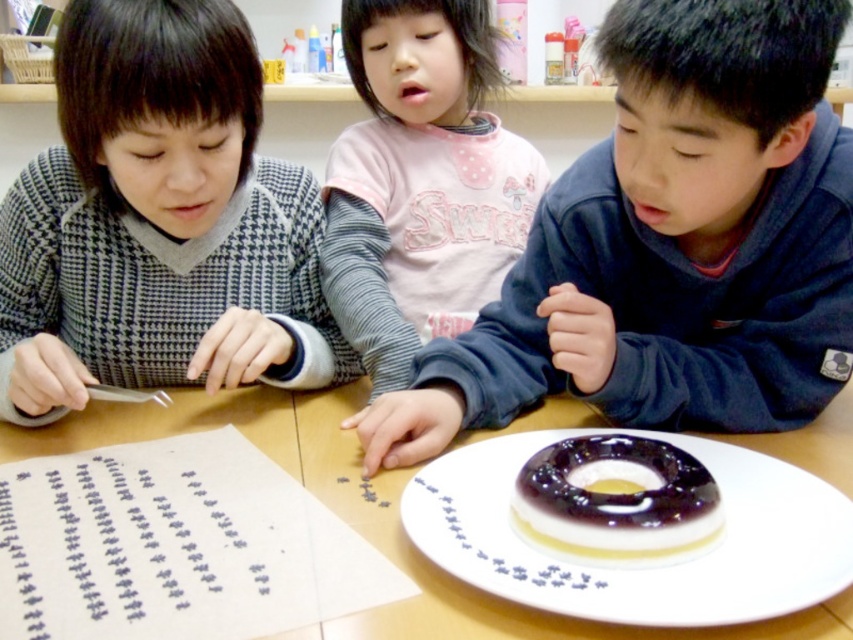
You are a teacher observing the children at the table. You notice the matte blue sweater at center and the black paper with blue ink at lower left. Which object is bigger in size?

The matte blue sweater at center is larger in size compared to the black paper with blue ink at lower left.

You are a photographer trying to capture a group photo of the gray houndstooth sweater at left and the pink cotton shirt at center. If you want to ensure both are fully visible in the frame, which child should be positioned closer to the camera?

The gray houndstooth sweater at left is wider than the pink cotton shirt at center, so positioning the gray houndstooth sweater at left closer to the camera will help ensure both are fully visible in the frame.

You are a teacher observing the children at the table. You notice the matte blue sweater at center and the black paper with blue ink at lower left. Which object is positioned closer to the right side of the table?

The matte blue sweater at center is positioned to the right of the black paper with blue ink at lower left, so it is closer to the right side of the table.